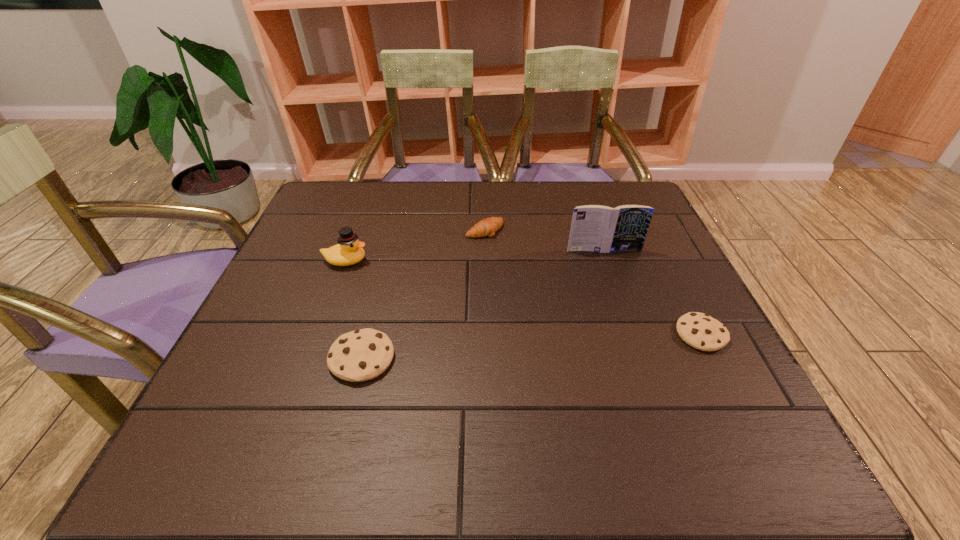
Where is `unoccupied area between the tallest object and the farthest object`? The image size is (960, 540). unoccupied area between the tallest object and the farthest object is located at coordinates (x=544, y=240).

The image size is (960, 540). What are the coordinates of `empty space that is in between the right cookie and the tallest object` in the screenshot? It's located at (653, 292).

At what (x,y) coordinates should I click in order to perform the action: click on the second closest object relative to the duck. Please return your answer as a coordinate pair (x, y). Looking at the image, I should click on (487, 227).

Locate which object is the closest to the third tallest object. Please provide its 2D coordinates. Your answer should be formatted as a tuple, i.e. [(x, y)], where the tuple contains the x and y coordinates of a point satisfying the conditions above.

[(349, 250)]

Find the location of a particular element. This screenshot has height=540, width=960. free space that satisfies the following two spatial constraints: 1. on the front-facing side of the shorter cookie; 2. on the left side of the duck is located at coordinates click(319, 334).

At what (x,y) coordinates should I click in order to perform the action: click on vacant region that satisfies the following two spatial constraints: 1. on the back side of the taller cookie; 2. on the front-facing side of the duck. Please return your answer as a coordinate pair (x, y). The height and width of the screenshot is (540, 960). Looking at the image, I should click on (387, 261).

Find the location of a particular element. free space in the image that satisfies the following two spatial constraints: 1. on the front cover of the tallest object; 2. on the front-facing side of the duck is located at coordinates (608, 261).

Where is `vacant region that satisfies the following two spatial constraints: 1. on the front-facing side of the third tallest object; 2. on the right side of the second tallest object`? The height and width of the screenshot is (540, 960). vacant region that satisfies the following two spatial constraints: 1. on the front-facing side of the third tallest object; 2. on the right side of the second tallest object is located at coordinates (310, 358).

I want to click on vacant space that satisfies the following two spatial constraints: 1. on the front cover of the tallest object; 2. on the front-facing side of the second tallest object, so click(x=608, y=261).

The image size is (960, 540). In order to click on vacant position in the image that satisfies the following two spatial constraints: 1. on the front-facing side of the right cookie; 2. on the right side of the fourth shortest object in this screenshot , I will do `click(319, 334)`.